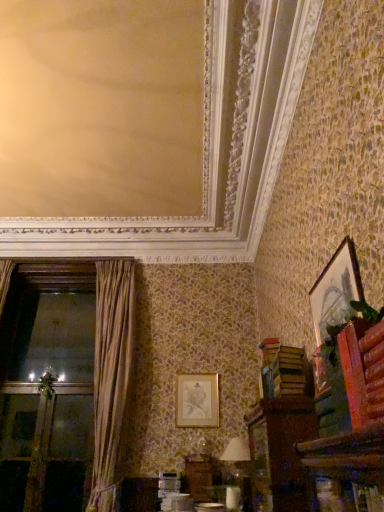
Question: From the image's perspective, is brown velvet curtain at left positioned above or below gold metallic picture frame at center, which ranks as the first picture frame in bottom-to-top order?

Choices:
 (A) below
 (B) above

Answer: (B)

Question: Considering the relative positions of brown velvet curtain at left and gold metallic picture frame at center, which is the second picture frame in front-to-back order, in the image provided, is brown velvet curtain at left to the left or to the right of gold metallic picture frame at center, which is the second picture frame in front-to-back order,?

Choices:
 (A) right
 (B) left

Answer: (B)

Question: Which object is the farthest from the brown wooden cabinet at lower right?

Choices:
 (A) white fabric lampshade at lower center
 (B) brown velvet curtain at left
 (C) gold-framed picture at upper right, positioned as the second picture frame in left-to-right order
 (D) gold metallic picture frame at center, which ranks as the first picture frame in bottom-to-top order
 (E) green leafy plant at upper right

Answer: (B)

Question: Which object is positioned farthest from the brown wooden cabinet at lower right?

Choices:
 (A) transparent glass screen door at left
 (B) green leafy plant at upper right
 (C) brown velvet curtain at left
 (D) white fabric lampshade at lower center
 (E) gold-framed picture at upper right, positioned as the second picture frame in left-to-right order

Answer: (A)